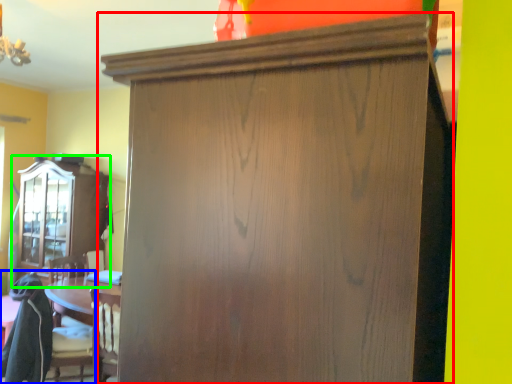
Question: Which is farther away from cupboard (highlighted by a red box)? swivel chair (highlighted by a blue box) or cabinetry (highlighted by a green box)?

Choices:
 (A) swivel chair
 (B) cabinetry

Answer: (B)